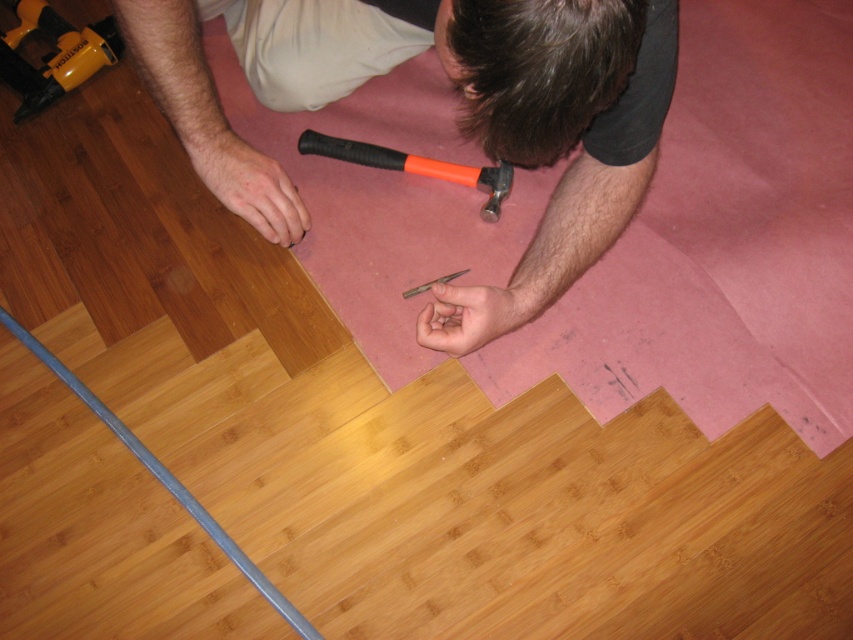
Question: Which point is farther to the camera?

Choices:
 (A) (498, 317)
 (B) (405, 291)
 (C) (70, 70)

Answer: (C)

Question: Which point is farther from the camera taking this photo?

Choices:
 (A) (421, 161)
 (B) (62, 76)
 (C) (641, 168)
 (D) (434, 280)

Answer: (B)

Question: In this image, where is yellow plastic drill at upper left located relative to orange rubber handle hammer at center?

Choices:
 (A) left
 (B) right

Answer: (A)

Question: Does yellow plastic drill at upper left have a larger size compared to metallic silver screwdriver at center?

Choices:
 (A) no
 (B) yes

Answer: (B)

Question: Does orange rubber handle hammer at center have a lesser width compared to metallic silver screwdriver at center?

Choices:
 (A) yes
 (B) no

Answer: (B)

Question: Which point is farther to the camera?

Choices:
 (A) metallic silver screwdriver at center
 (B) orange rubber handle hammer at center

Answer: (B)